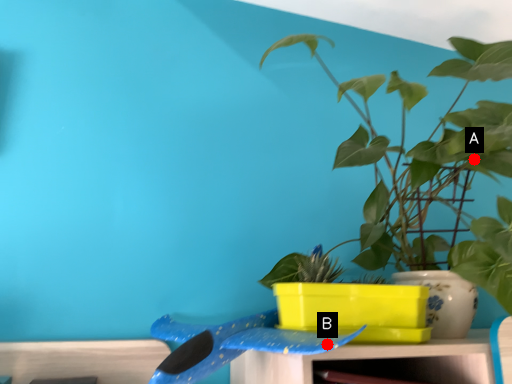
Question: Two points are circled on the image, labeled by A and B beside each circle. Which of the following is the farthest from the observer?

Choices:
 (A) A is further
 (B) B is further

Answer: (A)